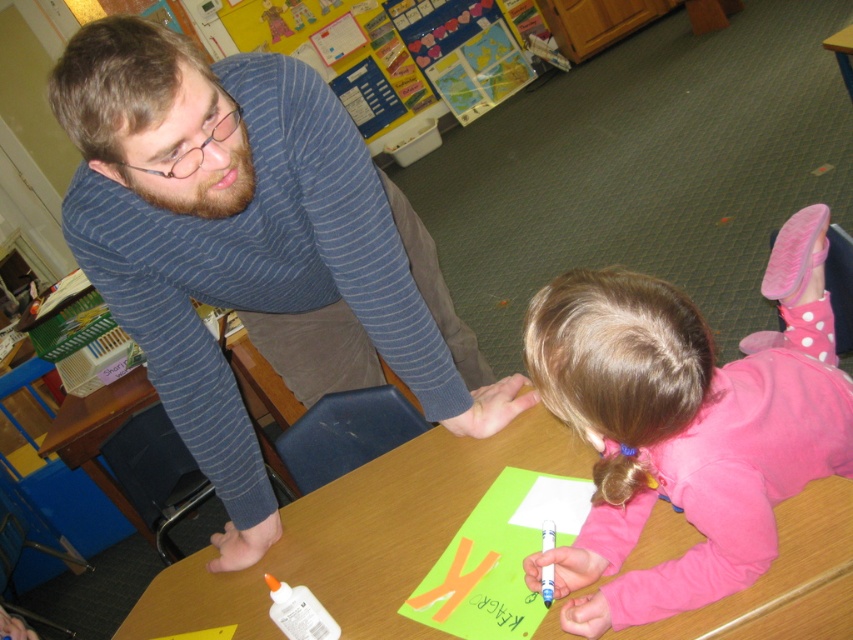
Is point (96, 246) farther from viewer compared to point (668, 451)?

Yes.

Which is above, blue striped sweater at upper left or pink fleece shirt at lower right?

pink fleece shirt at lower right is above.

Locate an element on the screen. This screenshot has height=640, width=853. blue striped sweater at upper left is located at coordinates click(x=252, y=248).

This screenshot has width=853, height=640. What do you see at coordinates (252, 248) in the screenshot?
I see `blue striped sweater at upper left` at bounding box center [252, 248].

Measure the distance between blue striped sweater at upper left and camera.

blue striped sweater at upper left is 35.85 inches away from camera.

Does point (200, 456) lie in front of point (839, 486)?

No, it is not.

At what (x,y) coordinates should I click in order to perform the action: click on blue striped sweater at upper left. Please return your answer as a coordinate pair (x, y). Looking at the image, I should click on (252, 248).

The image size is (853, 640). What do you see at coordinates (686, 426) in the screenshot?
I see `pink fleece shirt at lower right` at bounding box center [686, 426].

Does pink fleece shirt at lower right have a lesser height compared to wooden table at center?

Incorrect, pink fleece shirt at lower right's height does not fall short of wooden table at center's.

What do you see at coordinates (686, 426) in the screenshot?
I see `pink fleece shirt at lower right` at bounding box center [686, 426].

At what (x,y) coordinates should I click in order to perform the action: click on pink fleece shirt at lower right. Please return your answer as a coordinate pair (x, y). Looking at the image, I should click on (686, 426).